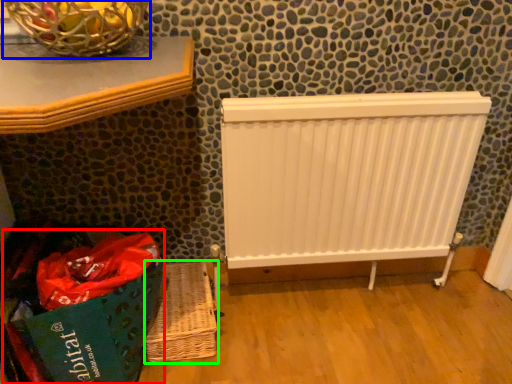
Question: Which object is positioned closest to shopping bag (highlighted by a red box)? Select from basket container (highlighted by a blue box) and basket (highlighted by a green box).

Choices:
 (A) basket container
 (B) basket

Answer: (B)